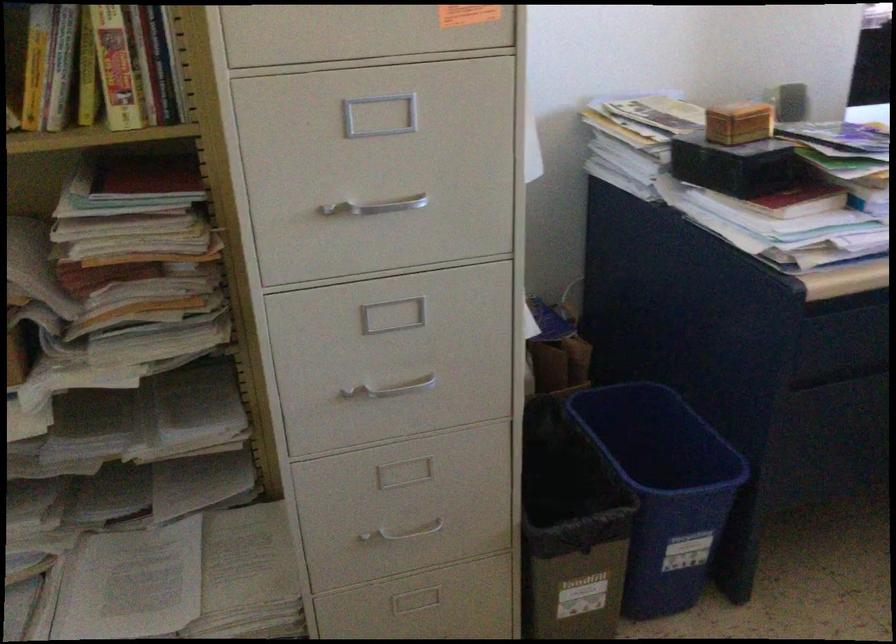
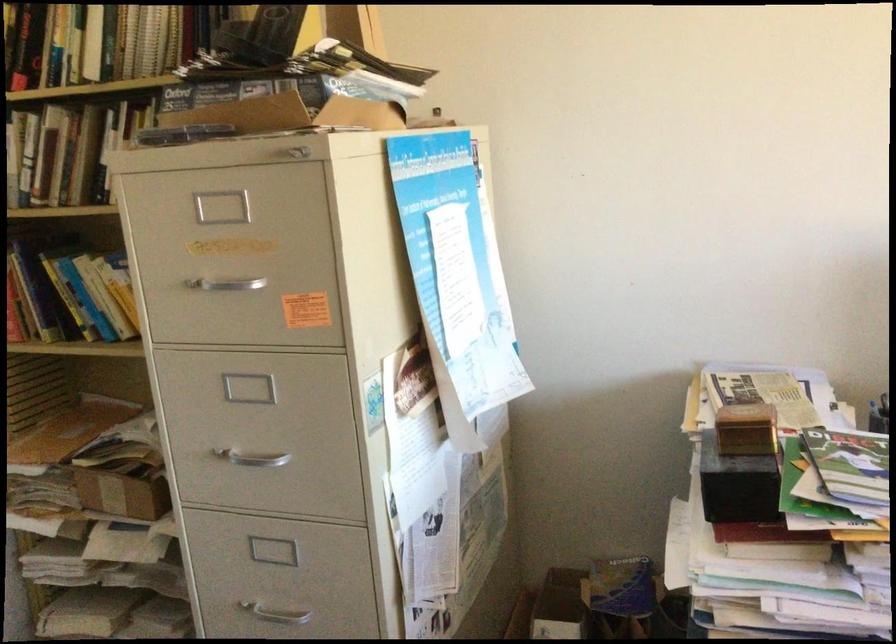
Question: The camera is either moving clockwise (left) or counter-clockwise (right) around the object. The first image is from the beginning of the video and the second image is from the end. Is the camera moving left or right when shooting the video?

Choices:
 (A) Left
 (B) Right

Answer: (B)